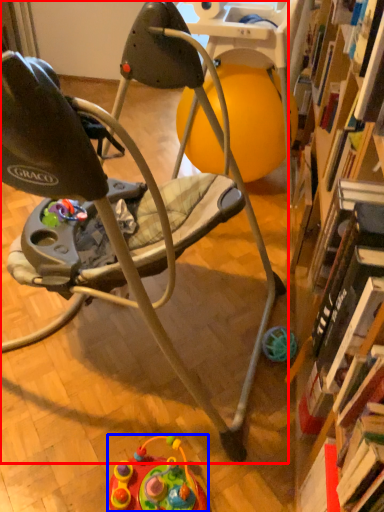
Question: Which of the following is the farthest to the observer, chair (highlighted by a red box) or toy (highlighted by a blue box)?

Choices:
 (A) chair
 (B) toy

Answer: (B)